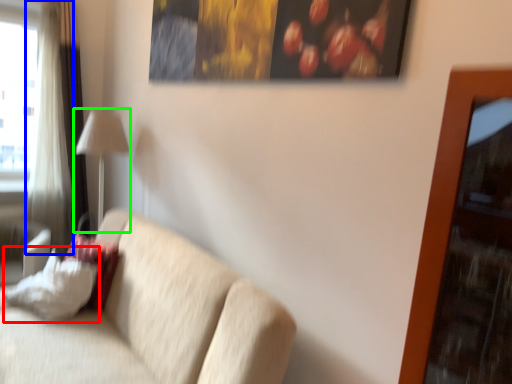
Question: Estimate the real-world distances between objects in this image. Which object is closer to pillow (highlighted by a red box), curtain (highlighted by a blue box) or table lamp (highlighted by a green box)?

Choices:
 (A) curtain
 (B) table lamp

Answer: (B)